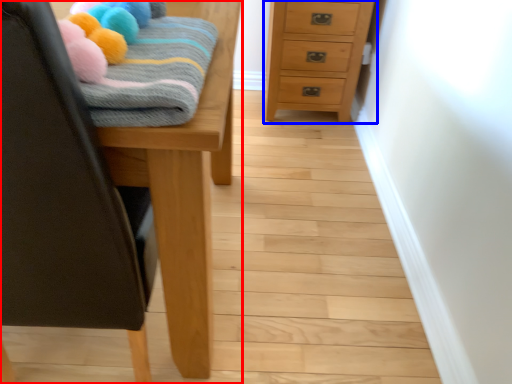
Question: Which point is closer to the camera, furniture (highlighted by a red box) or chest of drawers (highlighted by a blue box)?

Choices:
 (A) furniture
 (B) chest of drawers

Answer: (A)